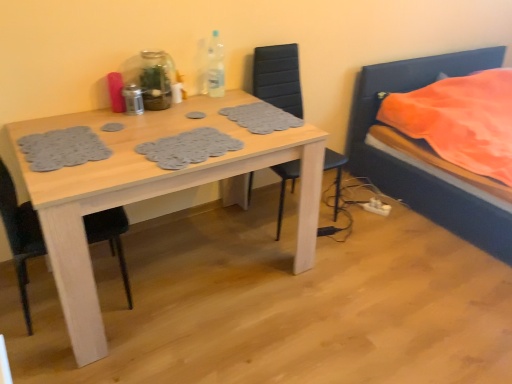
What are the coordinates of `vacant space that is to the left of metallic silver shaker at table center, acting as the 1th bottle starting from the left` in the screenshot? It's located at (104, 114).